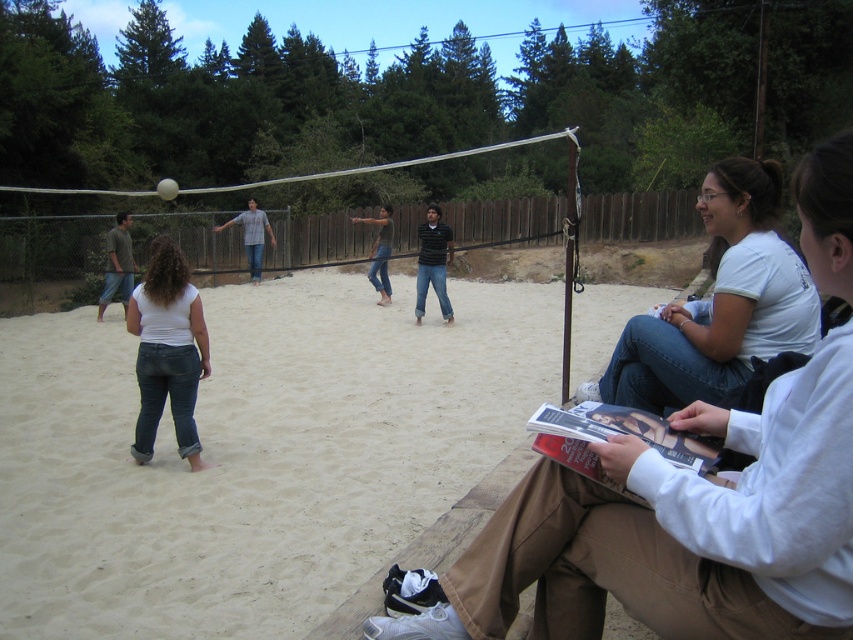
Question: Is beige sand at center positioned before striped cotton shirt at center?

Choices:
 (A) no
 (B) yes

Answer: (B)

Question: Among these objects, which one is nearest to the camera?

Choices:
 (A) striped cotton shirt at center
 (B) white cotton shirt at right

Answer: (B)

Question: Is white matte jeans at center thinner than denim jeans at center?

Choices:
 (A) yes
 (B) no

Answer: (B)

Question: Does white cotton shirt at right have a larger size compared to white matte jeans at center?

Choices:
 (A) no
 (B) yes

Answer: (B)

Question: Among these objects, which one is nearest to the camera?

Choices:
 (A) striped cotton shirt at center
 (B) white matte jeans at center
 (C) beige sand at center
 (D) white cotton shirt at right

Answer: (C)

Question: Which of the following is the closest to the observer?

Choices:
 (A) striped cotton shirt at center
 (B) jeans at center
 (C) white cotton shirt at right

Answer: (B)